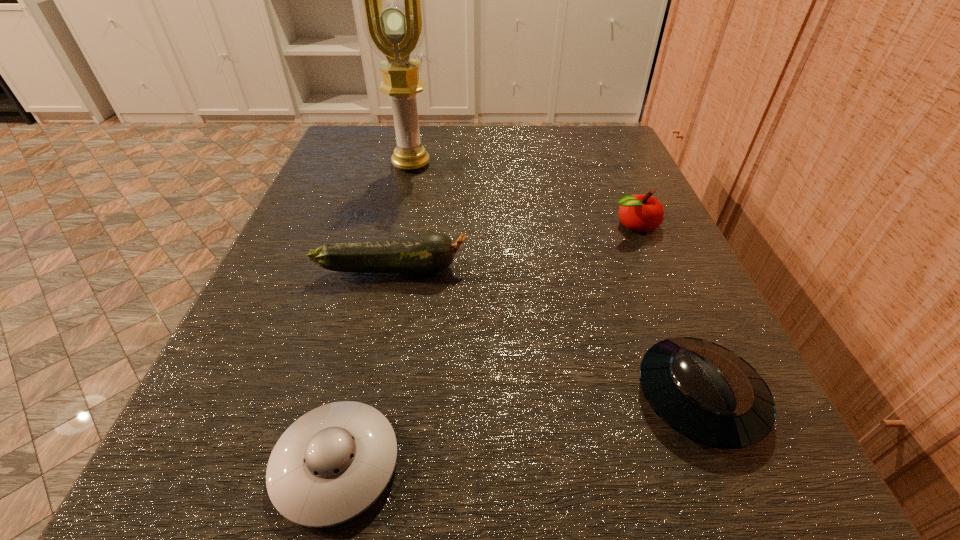
Identify the location of award. This screenshot has height=540, width=960. [x=392, y=0].

Find the location of a particular element. This screenshot has height=540, width=960. the tallest object is located at coordinates (392, 0).

This screenshot has width=960, height=540. Identify the location of the second farthest object. (642, 213).

Where is `zucchini`? zucchini is located at coordinates (427, 253).

Where is `the right saucer`? The image size is (960, 540). the right saucer is located at coordinates (709, 394).

You are a GUI agent. You are given a task and a screenshot of the screen. Output one action in this format:
    pyautogui.click(x=<x>, y=<y>)
    Task: Click on the shorter saucer
    This screenshot has height=540, width=960.
    Given the screenshot: What is the action you would take?
    pyautogui.click(x=330, y=465)

Locate an element on the screen. the left saucer is located at coordinates (330, 465).

Where is `vacant space located 0.120m on the front-facing side of the award`? vacant space located 0.120m on the front-facing side of the award is located at coordinates (x=400, y=211).

Locate an element on the screen. This screenshot has height=540, width=960. free space located on the front of the second farthest object is located at coordinates (677, 325).

Locate an element on the screen. This screenshot has width=960, height=540. vacant region located at the blossom end of the third farthest object is located at coordinates (530, 268).